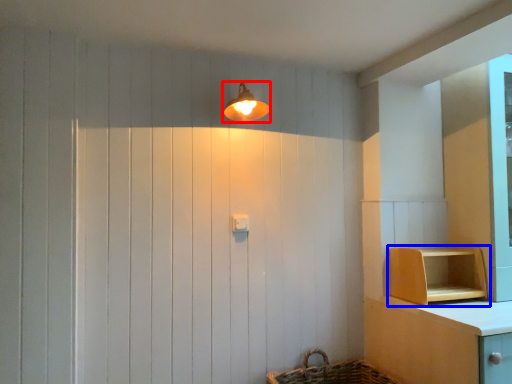
Question: Among these objects, which one is nearest to the camera, light fixture (highlighted by a red box) or shelf (highlighted by a blue box)?

Choices:
 (A) light fixture
 (B) shelf

Answer: (A)